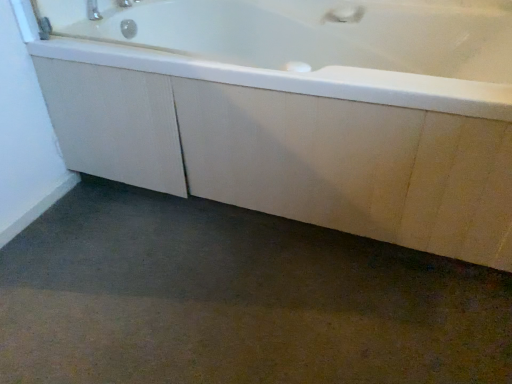
What do you see at coordinates (298, 110) in the screenshot? I see `white matte bathtub at center` at bounding box center [298, 110].

In order to click on white matte bathtub at center in this screenshot , I will do `click(298, 110)`.

This screenshot has width=512, height=384. In order to click on white matte bathtub at center in this screenshot , I will do `click(298, 110)`.